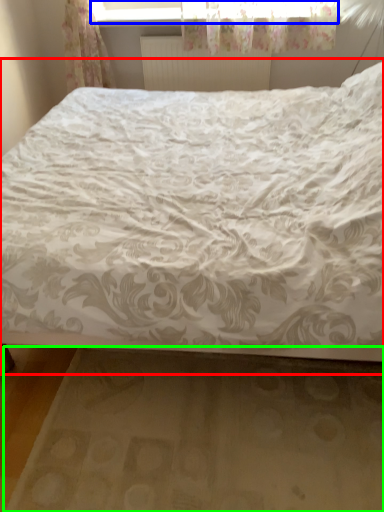
Question: Considering the real-world distances, which object is closest to bed (highlighted by a red box)? window frame (highlighted by a blue box) or bed frame (highlighted by a green box).

Choices:
 (A) window frame
 (B) bed frame

Answer: (B)